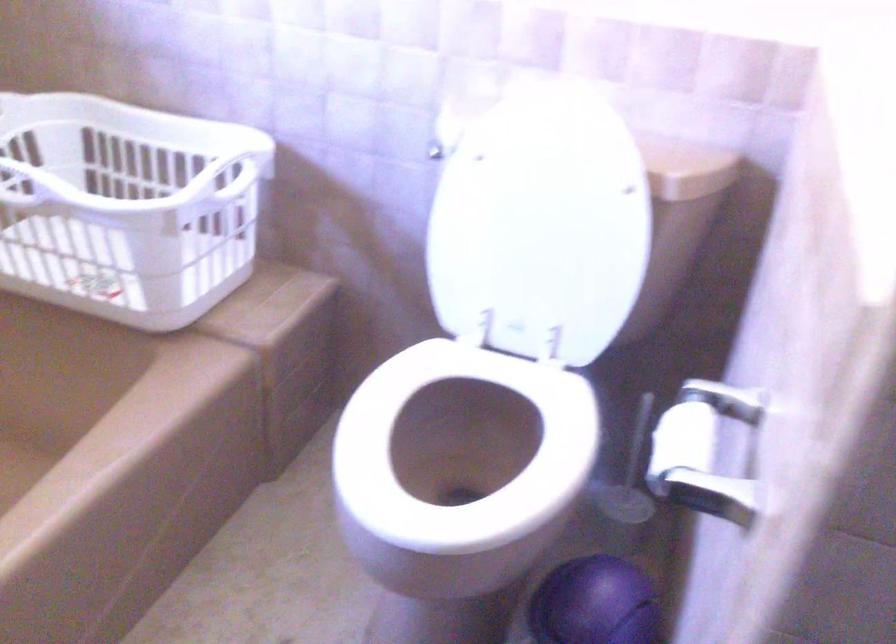
In order to click on white toilet lid in this screenshot , I will do `click(539, 225)`.